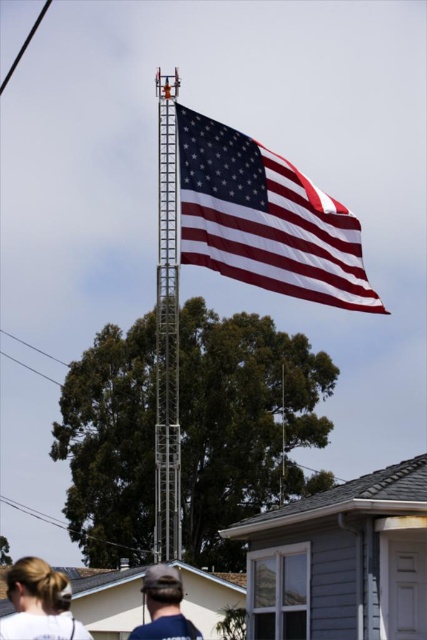
You are standing in front of the flag and want to take a photo of both the polished cotton flag at upper center and the person with blonde hair at lower left. Can you fit both in the frame without moving your camera?

The polished cotton flag at upper center has a lesser height compared to blonde hair at lower left, so the flag is shorter than the person. Since the flag is at upper center and the person is at lower left, you can position your camera to include both in the frame by adjusting the angle to capture the flag above and the person below.

You are standing at the point with coordinates point (195, 632) and want to move to the point with coordinates point (219, 273). Is there a clear path between these two points without any obstacles?

Point (219, 273) is behind point (195, 632), so there might be an obstacle blocking the path between them. You may need to go around point (195, 632) to reach point (219, 273).